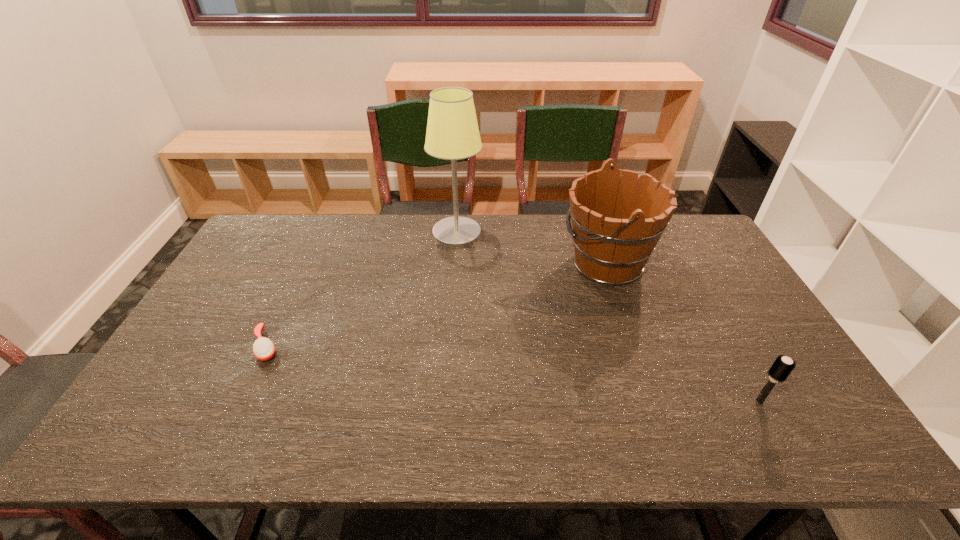
This screenshot has height=540, width=960. Find the location of `unoccupied area between the table lamp and the farther hairbrush`. unoccupied area between the table lamp and the farther hairbrush is located at coordinates (362, 289).

Find the location of a particular element. Image resolution: width=960 pixels, height=540 pixels. free space between the second tallest object and the tallest object is located at coordinates coord(532,248).

I want to click on vacant area that lies between the leftmost object and the second object from left to right, so click(x=362, y=289).

You are a GUI agent. You are given a task and a screenshot of the screen. Output one action in this format:
    pyautogui.click(x=<x>, y=<y>)
    Task: Click on the free space between the wine bucket and the left hairbrush
    
    Given the screenshot: What is the action you would take?
    pyautogui.click(x=436, y=305)

Where is `the closest object relative to the second object from left to right`? This screenshot has height=540, width=960. the closest object relative to the second object from left to right is located at coordinates (616, 226).

Locate an element on the screen. object that stands as the closest to the second nearest object is located at coordinates (452, 133).

Where is `free space that satisfies the following two spatial constraints: 1. with the handle on the second object from right to left; 2. on the front side of the third farthest object`? The width and height of the screenshot is (960, 540). free space that satisfies the following two spatial constraints: 1. with the handle on the second object from right to left; 2. on the front side of the third farthest object is located at coordinates (634, 346).